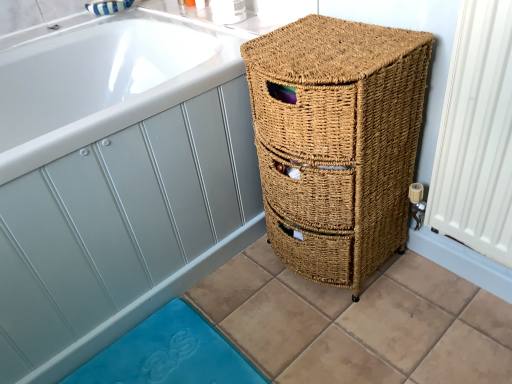
The width and height of the screenshot is (512, 384). I want to click on free location above blue rubber bath mat at lower left (from a real-world perspective), so click(x=158, y=354).